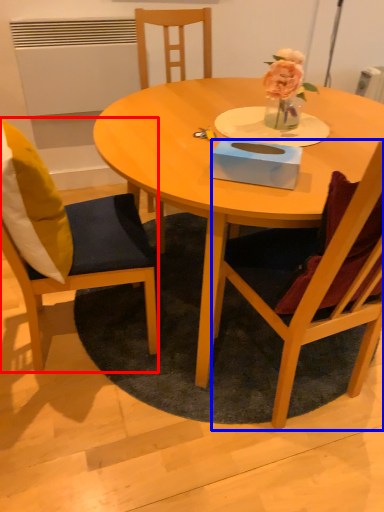
Question: Among these objects, which one is farthest to the camera, chair (highlighted by a red box) or chair (highlighted by a blue box)?

Choices:
 (A) chair
 (B) chair

Answer: (A)